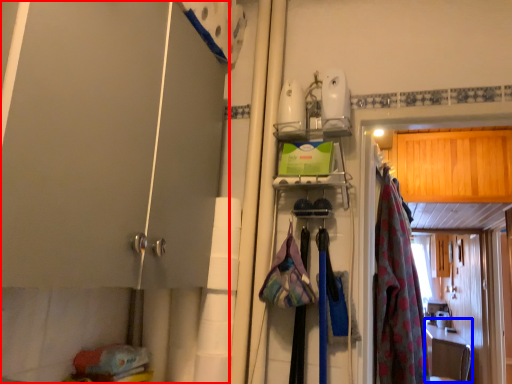
Question: Which object is further to the camera taking this photo, door (highlighted by a red box) or counter top (highlighted by a blue box)?

Choices:
 (A) door
 (B) counter top

Answer: (B)